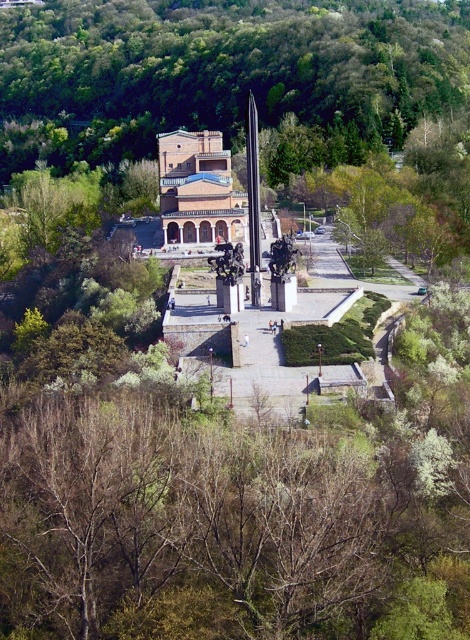
Based on the photo, who is lower down, green leafy trees at center or brick textured church at center?

brick textured church at center

Looking at this image, how far apart are green leafy trees at center and brick textured church at center?

The distance of green leafy trees at center from brick textured church at center is 110.88 meters.

Is point (280, 115) closer to camera compared to point (206, 189)?

No, (280, 115) is behind (206, 189).

I want to click on green leafy trees at center, so click(219, 70).